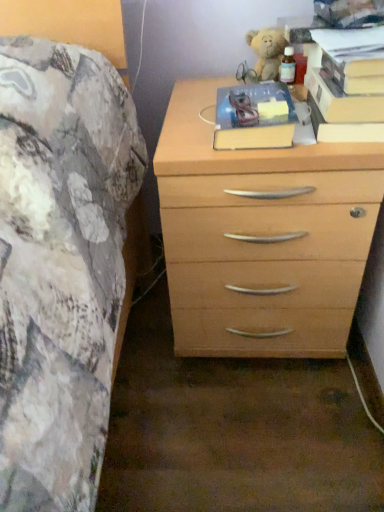
Question: From the image's perspective, relative to hardcover book at upper right, placed as the third paperback book when sorted from left to right, is hardcover book at center, the 3th paperback book viewed from the right, above or below?

Choices:
 (A) above
 (B) below

Answer: (B)

Question: In terms of size, does hardcover book at center, which appears as the 1th paperback book when viewed from the left, appear bigger or smaller than hardcover book at upper right, placed as the third paperback book when sorted from left to right?

Choices:
 (A) big
 (B) small

Answer: (A)

Question: Based on their relative distances, which object is nearer to the hardcover book at upper right, which ranks as the 2th paperback book in right-to-left order?

Choices:
 (A) fluffy beige teddy bear at upper right
 (B) light wood chest of drawers at right
 (C) hardcover book at upper right, marked as the first paperback book in a right-to-left arrangement
 (D) hardcover book at center, the 3th paperback book viewed from the right

Answer: (C)

Question: Estimate the real-world distances between objects in this image. Which object is closer to the hardcover book at upper right, placed as the third paperback book when sorted from left to right?

Choices:
 (A) fluffy beige teddy bear at upper right
 (B) light wood chest of drawers at right
 (C) hardcover book at center, which appears as the 1th paperback book when viewed from the left
 (D) hardcover book at upper right, which ranks as the 2th paperback book in right-to-left order

Answer: (D)